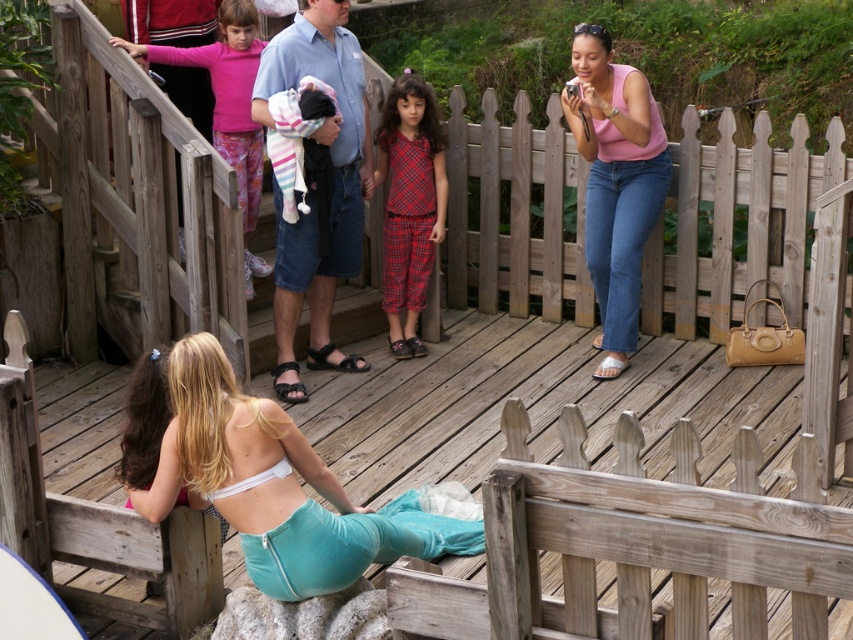
Does point (404, 266) come farther from viewer compared to point (225, 80)?

Yes, point (404, 266) is behind point (225, 80).

The height and width of the screenshot is (640, 853). I want to click on plaid fabric pajamas at center, so click(x=409, y=204).

You are a GUI agent. You are given a task and a screenshot of the screen. Output one action in this format:
    pyautogui.click(x=<x>, y=<y>)
    Task: Click on the plaid fabric pajamas at center
    
    Given the screenshot: What is the action you would take?
    pyautogui.click(x=409, y=204)

Looking at this image, is white matte bikini top at lower center wider than plaid fabric pajamas at center?

Yes.

Who is more distant from viewer, [305,556] or [392,148]?

The point [392,148] is behind.

You are a GUI agent. You are given a task and a screenshot of the screen. Output one action in this format:
    pyautogui.click(x=<x>, y=<y>)
    Task: Click on the white matte bikini top at lower center
    The height and width of the screenshot is (640, 853).
    Given the screenshot: What is the action you would take?
    (273, 486)

Where is `white matte bikini top at lower center`? The width and height of the screenshot is (853, 640). white matte bikini top at lower center is located at coordinates (273, 486).

Is white matte bikini top at lower center smaller than pink matte tank top at upper right?

Actually, white matte bikini top at lower center might be larger than pink matte tank top at upper right.

The width and height of the screenshot is (853, 640). Describe the element at coordinates (273, 486) in the screenshot. I see `white matte bikini top at lower center` at that location.

Does point (192, 392) come closer to viewer compared to point (640, 195)?

Yes.

Where is `white matte bikini top at lower center`? white matte bikini top at lower center is located at coordinates (273, 486).